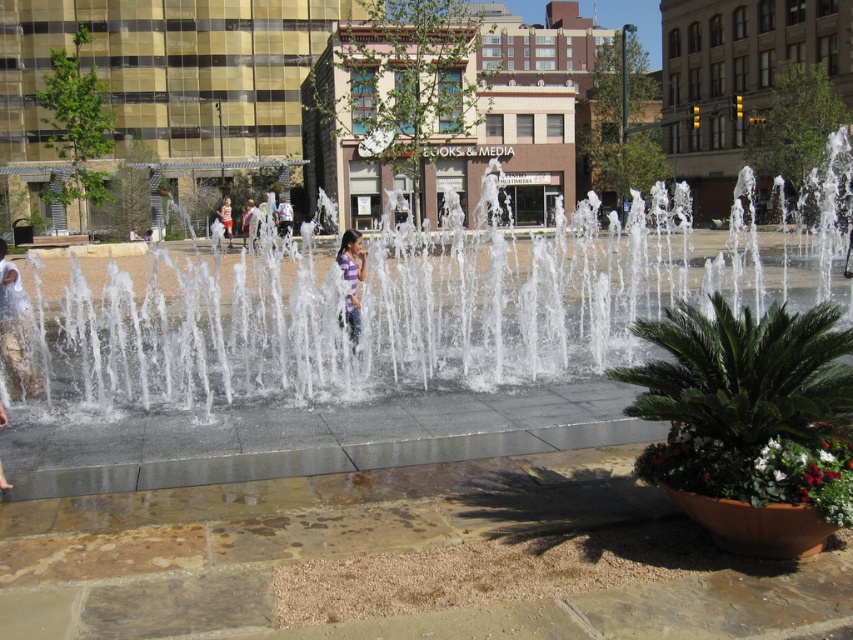
Is clear water at center wider than light blue jeans at center?

Correct, the width of clear water at center exceeds that of light blue jeans at center.

Which is behind, point (68, 392) or point (283, 208)?

The point (283, 208) is more distant.

This screenshot has height=640, width=853. Find the location of `clear water at center`. clear water at center is located at coordinates (381, 314).

Locate an element on the screen. The image size is (853, 640). clear water at center is located at coordinates (381, 314).

Consider the image. Is clear water at center above matte purple shirt at center?

No, clear water at center is not above matte purple shirt at center.

Does point (132, 380) come farther from viewer compared to point (225, 212)?

No.

Who is more forward, (838,141) or (224,234)?

Point (838,141)

The image size is (853, 640). I want to click on clear water at center, so click(x=381, y=314).

Who is taller, light blue jeans at center or matte purple shirt at center?

Standing taller between the two is light blue jeans at center.

Find the location of a particular element. Image resolution: width=853 pixels, height=640 pixels. light blue jeans at center is located at coordinates (x=283, y=216).